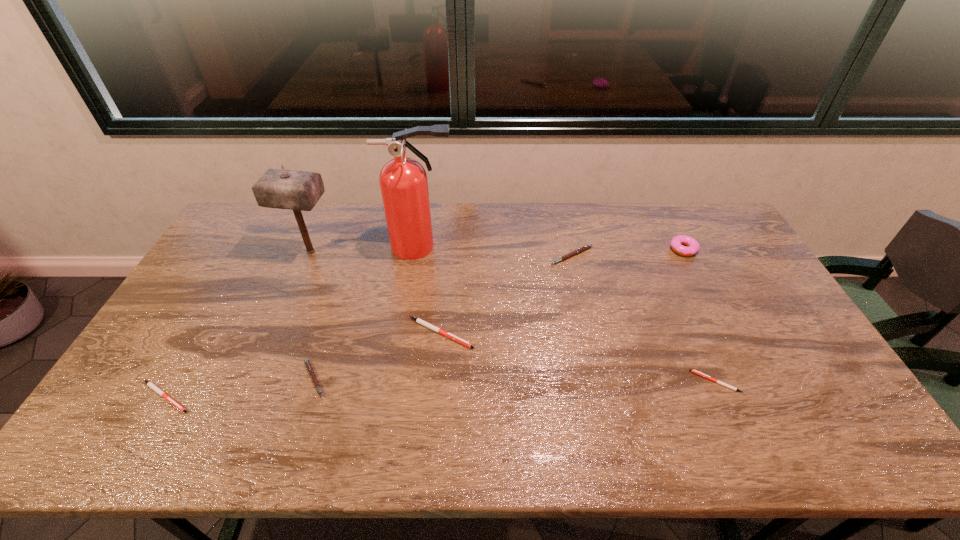
The width and height of the screenshot is (960, 540). What are the coordinates of `vacant area between the rightmost pen and the leftmost pen` in the screenshot? It's located at (441, 389).

At what (x,y) coordinates should I click in order to perform the action: click on free space between the fourth pen from left to right and the second farthest pen. Please return your answer as a coordinate pair (x, y). This screenshot has width=960, height=540. Looking at the image, I should click on (506, 294).

What are the coordinates of `free space between the right pink pen and the leftmost pen` in the screenshot? It's located at (368, 326).

This screenshot has width=960, height=540. Identify the location of empty space that is in between the smallest white pen and the seventh object from right to left. (513, 316).

Identify the location of vacant area between the left pink pen and the leftmost pen. (239, 388).

Identify which object is located as the fifth nearest to the second object from left to right. Please provide its 2D coordinates. Your answer should be formatted as a tuple, i.e. [(x, y)], where the tuple contains the x and y coordinates of a point satisfying the conditions above.

[(581, 249)]

You are a GUI agent. You are given a task and a screenshot of the screen. Output one action in this format:
    pyautogui.click(x=<x>, y=<y>)
    Task: Click on the object that is the fourth nearest to the rightmost white pen
    The image size is (960, 540).
    Given the screenshot: What is the action you would take?
    pyautogui.click(x=403, y=181)

The width and height of the screenshot is (960, 540). I want to click on pen that is the fourth closest to the shortest object, so click(x=150, y=384).

Identify which pen is located as the fifth nearest to the doughnut. Please provide its 2D coordinates. Your answer should be formatted as a tuple, i.e. [(x, y)], where the tuple contains the x and y coordinates of a point satisfying the conditions above.

[(150, 384)]

I want to click on white pen that can be found as the third closest to the mallet, so click(x=694, y=371).